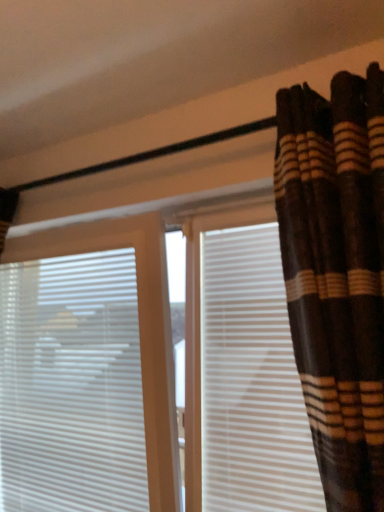
Question: From the image's perspective, is brown striped fabric at upper right positioned above or below white plastic blinds at left?

Choices:
 (A) below
 (B) above

Answer: (B)

Question: From their relative heights in the image, would you say brown striped fabric at upper right is taller or shorter than white plastic blinds at left?

Choices:
 (A) tall
 (B) short

Answer: (A)

Question: Estimate the real-world distances between objects in this image. Which object is farther from the white plastic blinds at left?

Choices:
 (A) brown striped fabric at upper right
 (B) white matte shutter at right

Answer: (A)

Question: Which of these objects is positioned closest to the white plastic blinds at left?

Choices:
 (A) brown striped fabric at upper right
 (B) white matte shutter at right

Answer: (B)